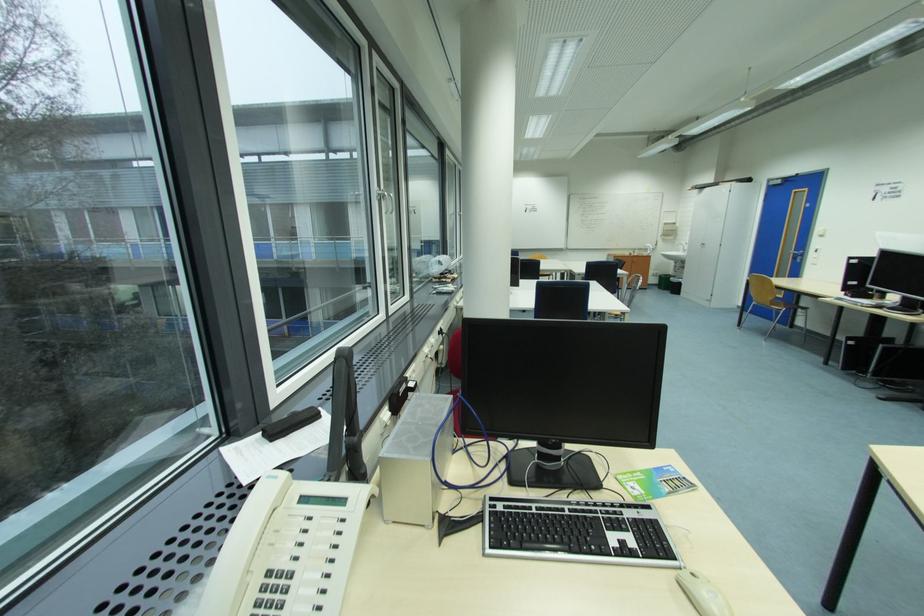
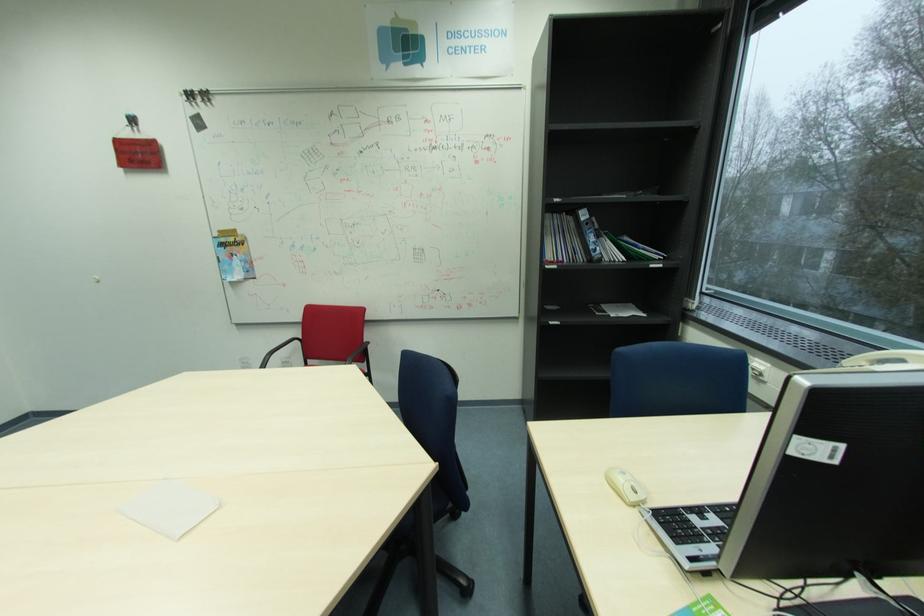
Locate, in the second image, the point that corresponds to the point at 652,516 in the first image.

(699, 551)